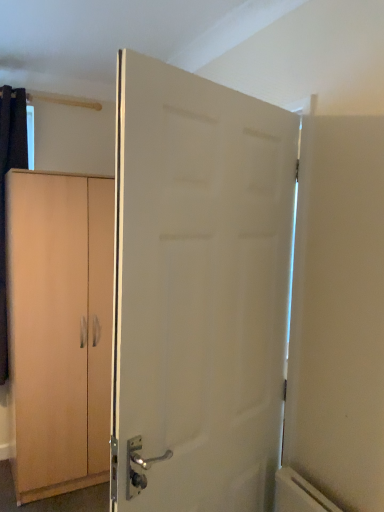
Question: Is light wood cabinet at left positioned with its back to white matte door at center?

Choices:
 (A) yes
 (B) no

Answer: (B)

Question: From a real-world perspective, is light wood cabinet at left on top of white matte door at center?

Choices:
 (A) yes
 (B) no

Answer: (B)

Question: Considering the relative positions of light wood cabinet at left and white matte door at center in the image provided, is light wood cabinet at left behind white matte door at center?

Choices:
 (A) yes
 (B) no

Answer: (A)

Question: Can you confirm if light wood cabinet at left is positioned to the left of white matte door at center?

Choices:
 (A) yes
 (B) no

Answer: (A)

Question: From the image's perspective, does light wood cabinet at left appear higher than white matte door at center?

Choices:
 (A) no
 (B) yes

Answer: (A)

Question: Can you confirm if light wood cabinet at left is wider than white matte door at center?

Choices:
 (A) yes
 (B) no

Answer: (A)

Question: Does white matte door at center have a lesser height compared to light wood cabinet at left?

Choices:
 (A) no
 (B) yes

Answer: (B)

Question: From the image's perspective, would you say white matte door at center is shown under light wood cabinet at left?

Choices:
 (A) no
 (B) yes

Answer: (A)

Question: Is white matte door at center positioned far away from light wood cabinet at left?

Choices:
 (A) yes
 (B) no

Answer: (A)

Question: Considering the relative sizes of white matte door at center and light wood cabinet at left in the image provided, is white matte door at center smaller than light wood cabinet at left?

Choices:
 (A) yes
 (B) no

Answer: (A)

Question: Are white matte door at center and light wood cabinet at left beside each other?

Choices:
 (A) yes
 (B) no

Answer: (B)

Question: Can you confirm if white matte door at center is wider than light wood cabinet at left?

Choices:
 (A) no
 (B) yes

Answer: (A)

Question: Relative to light wood cabinet at left, is white matte door at center in front or behind?

Choices:
 (A) front
 (B) behind

Answer: (A)